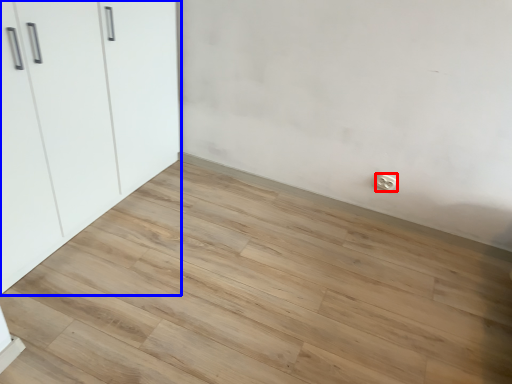
Question: Which of the following is the farthest to the observer, electric outlet (highlighted by a red box) or cupboard (highlighted by a blue box)?

Choices:
 (A) electric outlet
 (B) cupboard

Answer: (A)